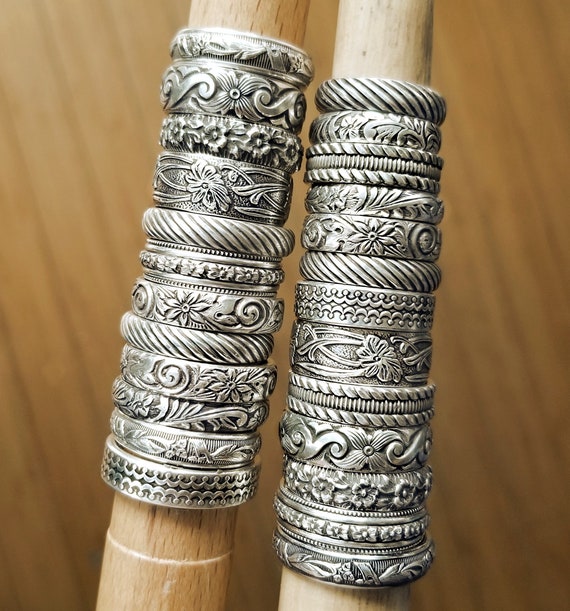
You are a GUI agent. You are given a task and a screenshot of the screen. Output one action in this format:
    pyautogui.click(x=<x>, y=<y>)
    Task: Click on the left ring holder
    
    Given the screenshot: What is the action you would take?
    pyautogui.click(x=186, y=533)